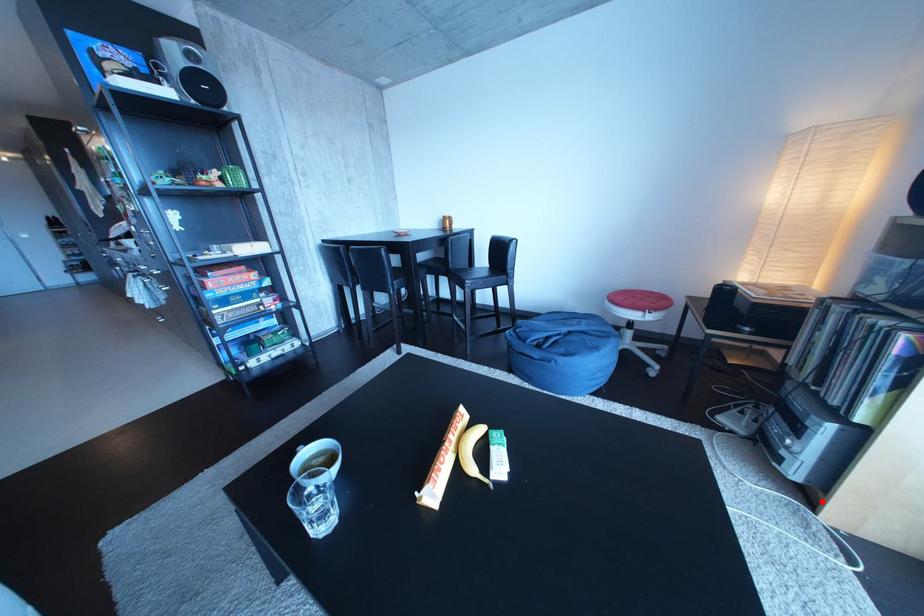
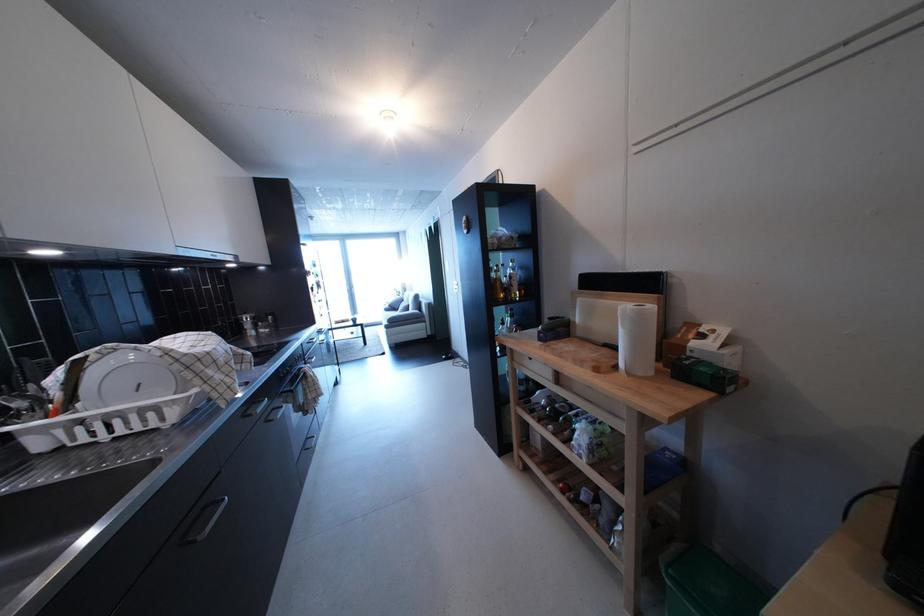
Question: I am providing you with two images of the same scene from different viewpoints. A red point is marked on the first image. At the location where the point appears in image 1, is it still visible in image 2?

Choices:
 (A) Yes
 (B) No

Answer: (B)